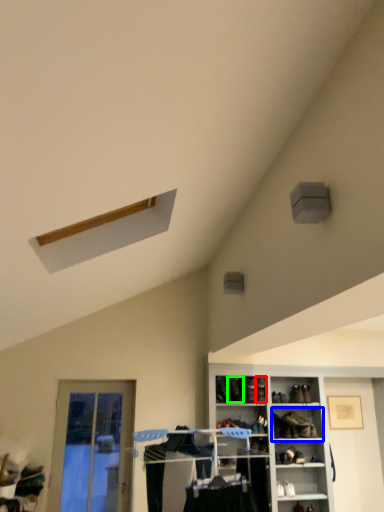
Question: Which is farther away from shoe (highlighted by a red box)? shelf (highlighted by a blue box) or shoe (highlighted by a green box)?

Choices:
 (A) shelf
 (B) shoe

Answer: (A)